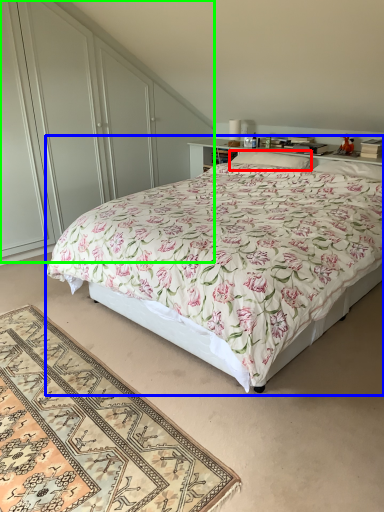
Question: Which object is the farthest from pillow (highlighted by a red box)? Choose among these: bed (highlighted by a blue box) or dresser (highlighted by a green box).

Choices:
 (A) bed
 (B) dresser

Answer: (B)